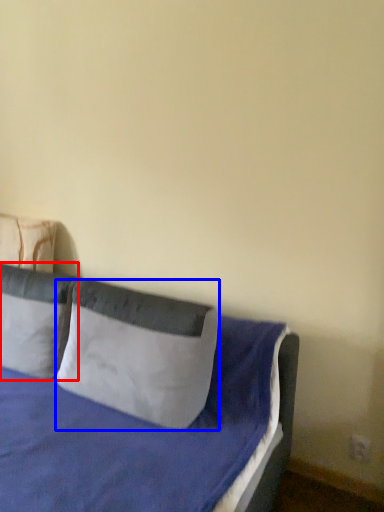
Question: Among these objects, which one is farthest to the camera, pillow (highlighted by a red box) or pillow (highlighted by a blue box)?

Choices:
 (A) pillow
 (B) pillow

Answer: (A)